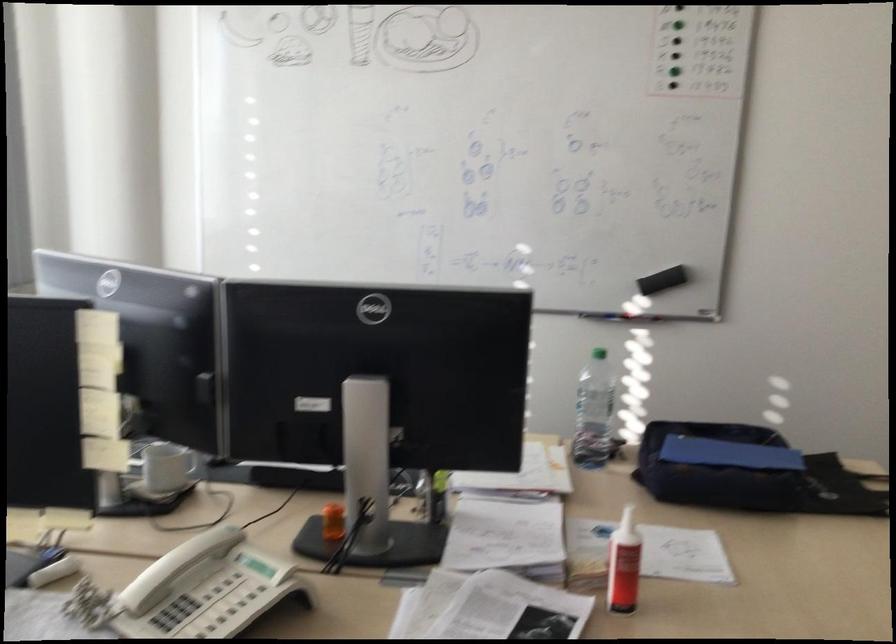
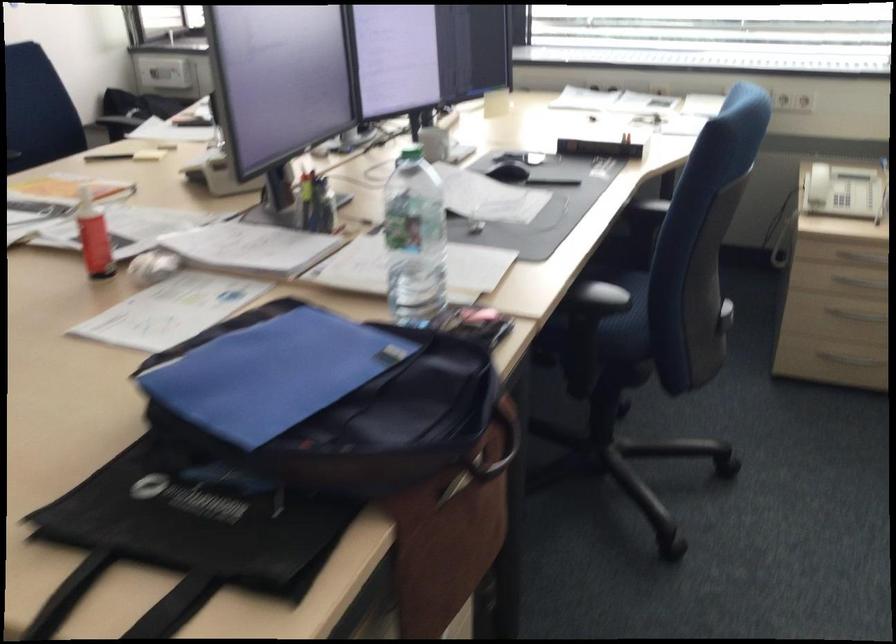
The point at (735, 447) is marked in the first image. Where is the corresponding point in the second image?

(271, 374)